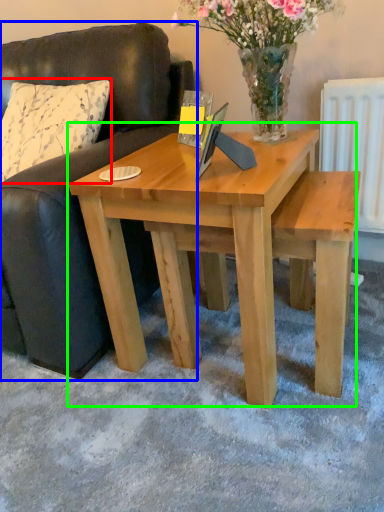
Question: Based on their relative distances, which object is nearer to pillow (highlighted by a red box)? Choose from studio couch (highlighted by a blue box) and coffee table (highlighted by a green box).

Choices:
 (A) studio couch
 (B) coffee table

Answer: (A)